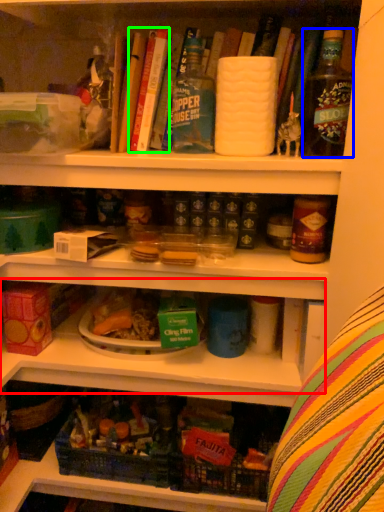
Question: Based on their relative distances, which object is nearer to shelf (highlighted by a red box)? Choose from bottle (highlighted by a blue box) and book (highlighted by a green box).

Choices:
 (A) bottle
 (B) book

Answer: (A)